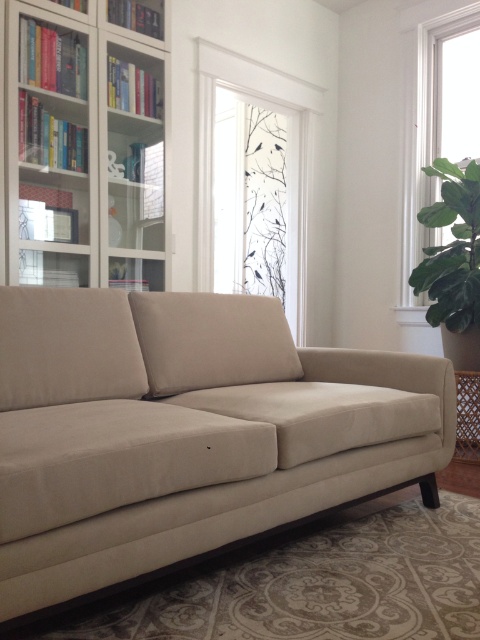
Between transparent glass window at upper center and clear glass window at upper right, which one has more height?

With more height is clear glass window at upper right.

Is transparent glass window at upper center bigger than clear glass window at upper right?

Indeed, transparent glass window at upper center has a larger size compared to clear glass window at upper right.

Which is behind, point (309, 225) or point (434, 147)?

The point (309, 225) is more distant.

The image size is (480, 640). Identify the location of transparent glass window at upper center. (288, 157).

Between white glossy bookcase at upper left and green leafy plant at right, which one is positioned higher?

white glossy bookcase at upper left is above.

Based on the photo, is white glossy bookcase at upper left smaller than green leafy plant at right?

Incorrect, white glossy bookcase at upper left is not smaller in size than green leafy plant at right.

Does point (117, 44) come farther from viewer compared to point (446, 188)?

No.

The width and height of the screenshot is (480, 640). What are the coordinates of `white glossy bookcase at upper left` in the screenshot? It's located at (83, 154).

Is beige fabric couch at center wider than clear glass window at upper right?

Yes.

Is point (144, 532) closer to camera compared to point (406, 182)?

Yes, point (144, 532) is closer to viewer.

Identify the location of beige fabric couch at center. The height and width of the screenshot is (640, 480). (186, 432).